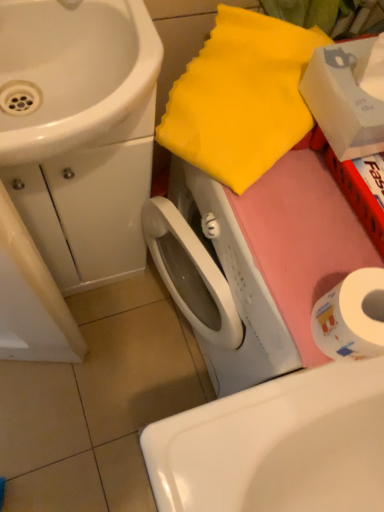
Question: Can you confirm if white glossy sink at lower center, which is the 2th sink in left-to-right order, is bigger than white glossy sink at upper left, the 2th sink positioned from the bottom?

Choices:
 (A) yes
 (B) no

Answer: (A)

Question: Is white glossy sink at lower center, which is counted as the 1th sink, starting from the bottom, facing towards white glossy sink at upper left, the 2th sink positioned from the bottom?

Choices:
 (A) yes
 (B) no

Answer: (B)

Question: From a real-world perspective, is white glossy sink at lower center, which is counted as the 1th sink, starting from the bottom, on top of white glossy sink at upper left, the 2th sink positioned from the bottom?

Choices:
 (A) yes
 (B) no

Answer: (B)

Question: From the image's perspective, does white glossy sink at lower center, positioned as the 1th sink in right-to-left order, appear lower than white glossy sink at upper left, the 2th sink positioned from the bottom?

Choices:
 (A) no
 (B) yes

Answer: (B)

Question: Would you consider white glossy sink at lower center, which is counted as the 1th sink, starting from the bottom, to be distant from white glossy sink at upper left, which ranks as the second sink in right-to-left order?

Choices:
 (A) yes
 (B) no

Answer: (B)

Question: Considering the positions of white glossy sink at upper left, the 2th sink positioned from the bottom, and white glossy sink at lower center, positioned as the 1th sink in right-to-left order, in the image, is white glossy sink at upper left, the 2th sink positioned from the bottom, wider or thinner than white glossy sink at lower center, positioned as the 1th sink in right-to-left order,?

Choices:
 (A) thin
 (B) wide

Answer: (A)

Question: Based on their sizes in the image, would you say white glossy sink at upper left, placed as the 1th sink when sorted from left to right, is bigger or smaller than white glossy sink at lower center, which is counted as the 1th sink, starting from the bottom?

Choices:
 (A) big
 (B) small

Answer: (B)

Question: Based on their positions, is white glossy sink at upper left, placed as the 1th sink when sorted from left to right, located to the left or right of white glossy sink at lower center, which is the 2th sink in left-to-right order?

Choices:
 (A) left
 (B) right

Answer: (A)

Question: In terms of height, does white glossy sink at upper left, which ranks as the second sink in right-to-left order, look taller or shorter compared to white glossy sink at lower center, which is counted as the 1th sink, starting from the bottom?

Choices:
 (A) tall
 (B) short

Answer: (A)

Question: In the image, is white cardboard box at upper right positioned in front of or behind white glossy sink at lower center, positioned as the 1th sink in right-to-left order?

Choices:
 (A) behind
 (B) front

Answer: (B)

Question: In terms of size, does white cardboard box at upper right appear bigger or smaller than white glossy sink at lower center, which is the 2th sink in left-to-right order?

Choices:
 (A) big
 (B) small

Answer: (B)

Question: Considering the positions of white cardboard box at upper right and white glossy sink at lower center, positioned as the 1th sink in right-to-left order, in the image, is white cardboard box at upper right taller or shorter than white glossy sink at lower center, positioned as the 1th sink in right-to-left order,?

Choices:
 (A) tall
 (B) short

Answer: (B)

Question: Does point (306, 83) appear closer or farther from the camera than point (173, 426)?

Choices:
 (A) farther
 (B) closer

Answer: (B)

Question: From a real-world perspective, is white paper at lower right above or below white cardboard box at upper right?

Choices:
 (A) below
 (B) above

Answer: (A)

Question: In the image, is white paper at lower right on the left side or the right side of white cardboard box at upper right?

Choices:
 (A) left
 (B) right

Answer: (A)